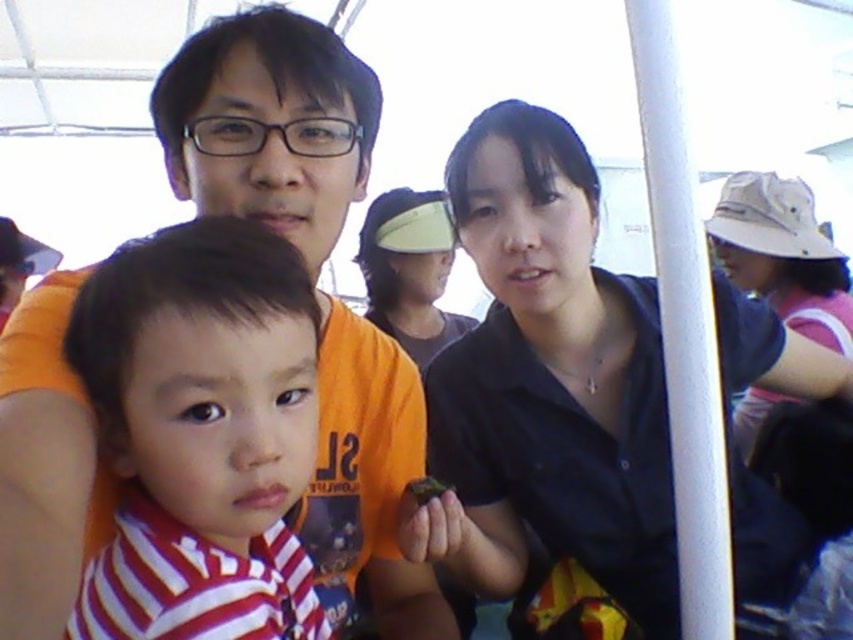
You are standing in front of the scene and want to hand a gift to the person wearing the black matte shirt at center and the striped fabric shirt at center. Which one can you reach first without moving?

The black matte shirt at center is closer to you than the striped fabric shirt at center, so you can reach the person wearing the black matte shirt at center first.